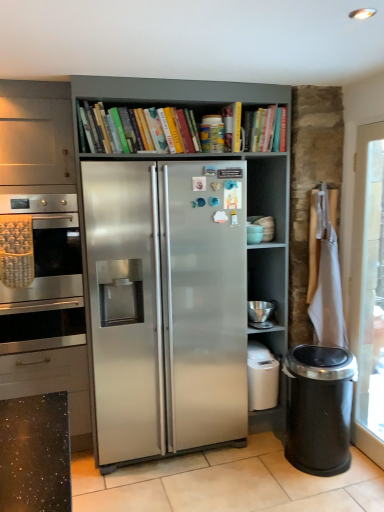
This screenshot has height=512, width=384. In order to click on unoccupied area in front of black plastic trash can at lower right in this screenshot , I will do `click(334, 495)`.